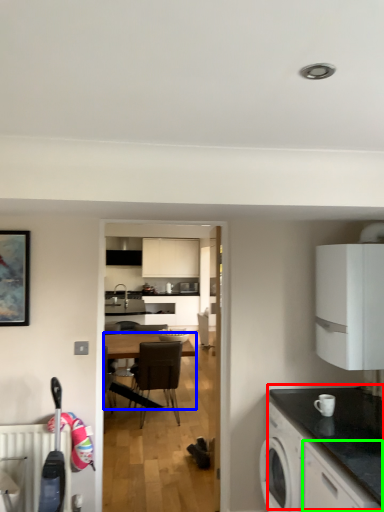
Question: Which object is positioned farthest from countertop (highlighted by a red box)? Select from desk (highlighted by a blue box) and cabinetry (highlighted by a green box).

Choices:
 (A) desk
 (B) cabinetry

Answer: (A)